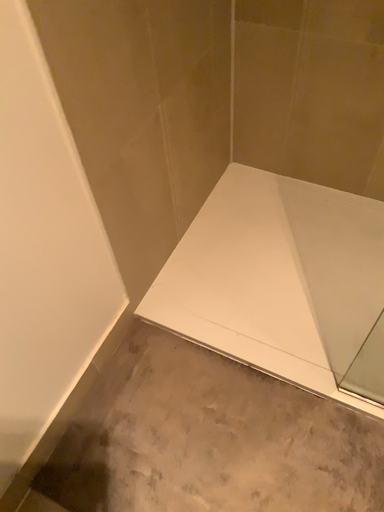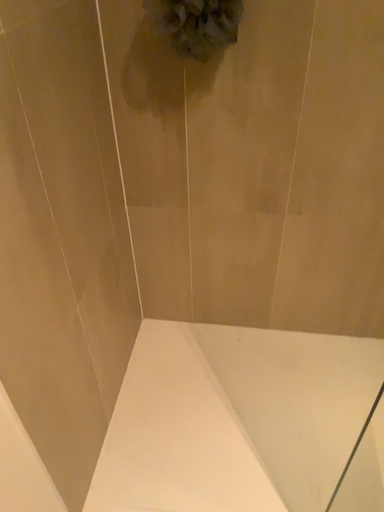
Question: Which way did the camera rotate in the video?

Choices:
 (A) rotated left
 (B) rotated right

Answer: (B)